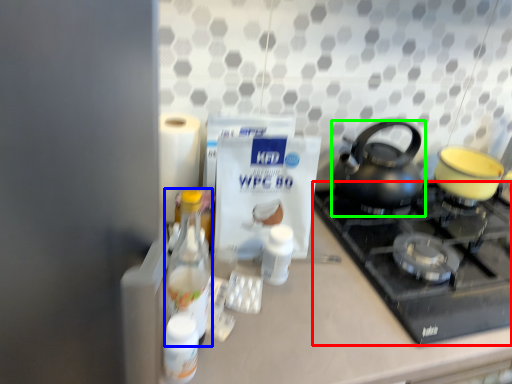
Question: Which is nearer to the gas stove (highlighted by a red box)? bottle (highlighted by a blue box) or kettle (highlighted by a green box).

Choices:
 (A) bottle
 (B) kettle

Answer: (B)